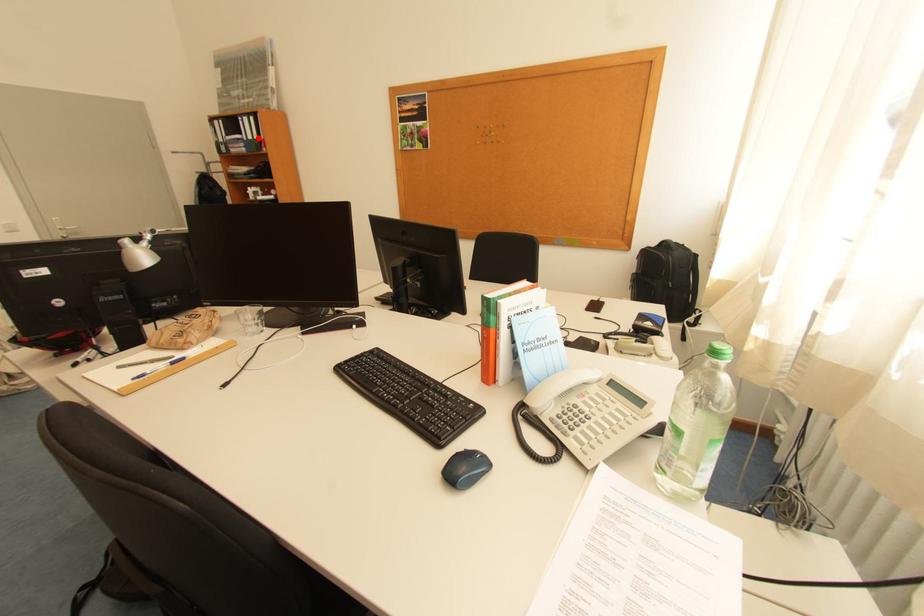
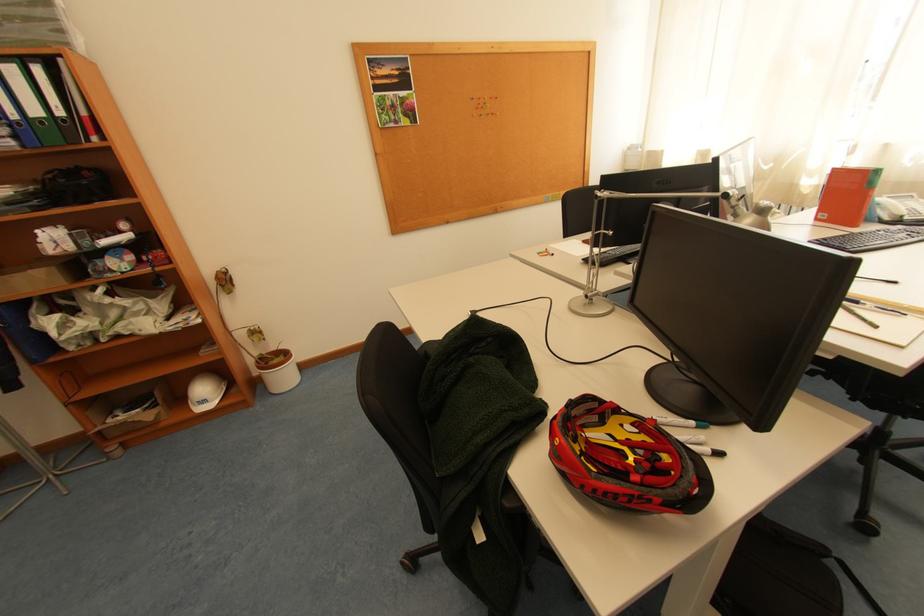
Question: I am providing you with two images of the same scene from different viewpoints. Image1 has a red point marked. In image2, the corresponding 3D location appears at what relative position? Reply with the corresponding letter.

Choices:
 (A) Closer
 (B) Farther

Answer: (B)